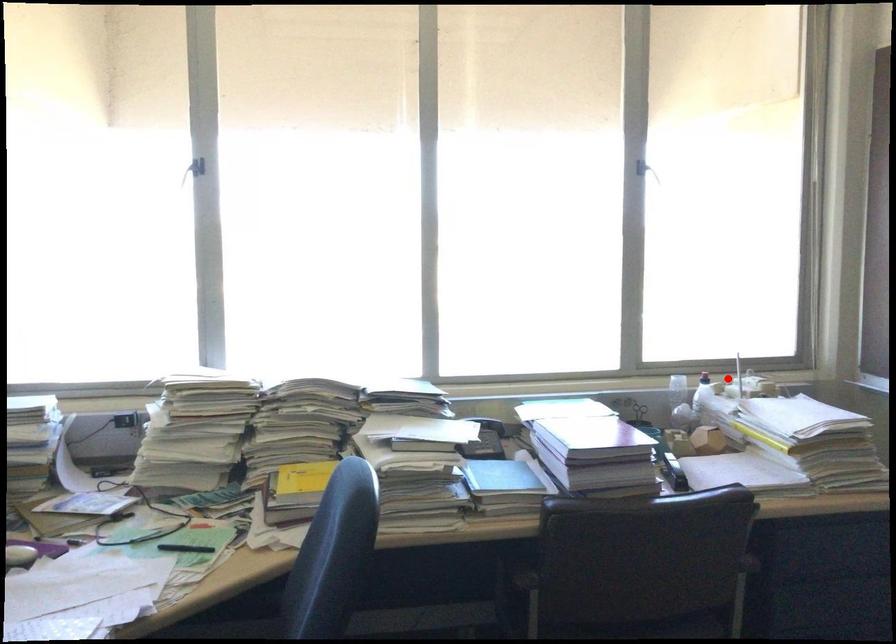
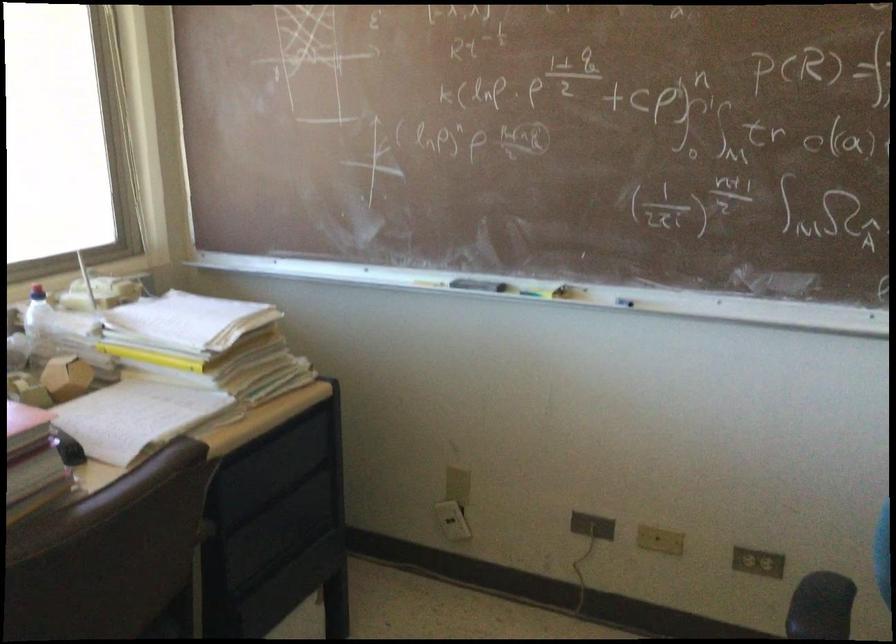
Locate, in the second image, the point that corresponds to the highlighted location in the first image.

(37, 292)